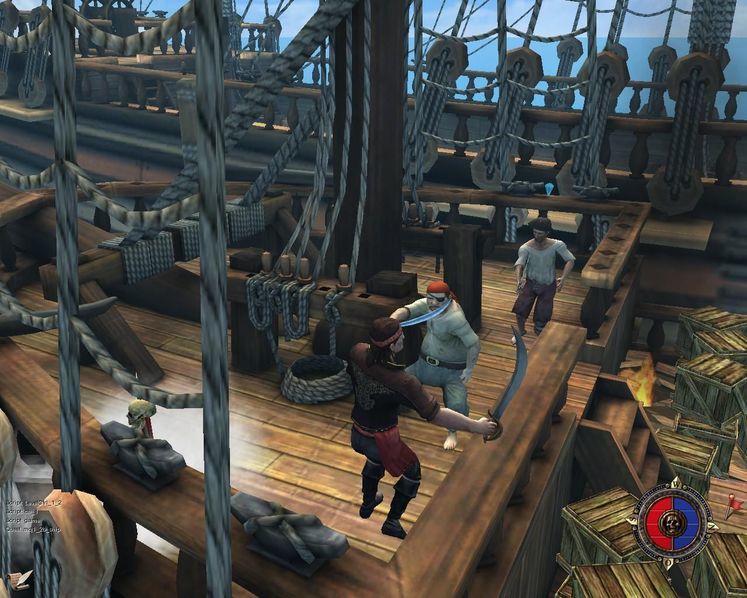
Where is `wooden crate`? wooden crate is located at coordinates (639, 581), (728, 572), (603, 521), (688, 457), (725, 432), (701, 390), (725, 343), (713, 314).